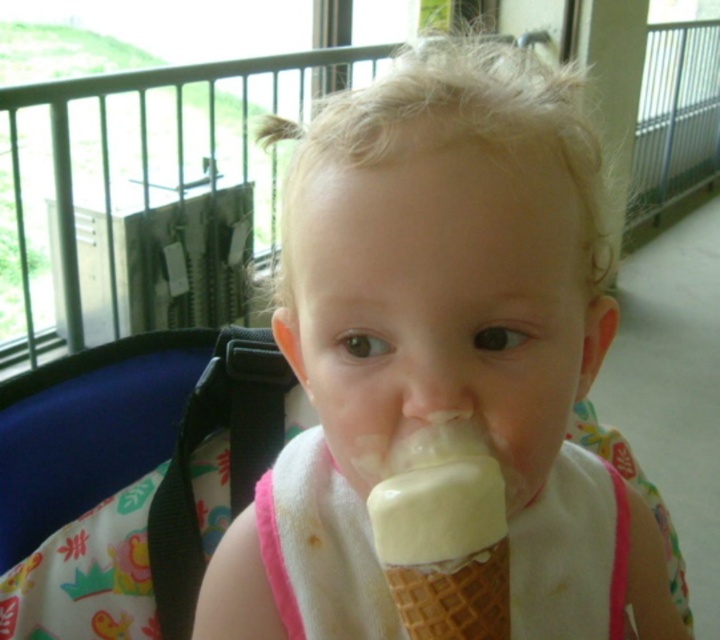
Is white matte ice cream cone at center to the left of vanilla ice cream at mouth from the viewer's perspective?

In fact, white matte ice cream cone at center is to the right of vanilla ice cream at mouth.

Does point (456, 193) come farther from viewer compared to point (392, 561)?

Yes, it is.

What are the coordinates of `white matte ice cream cone at center` in the screenshot? It's located at (441, 344).

The image size is (720, 640). Describe the element at coordinates (441, 344) in the screenshot. I see `white matte ice cream cone at center` at that location.

Which is more to the left, white matte ice cream cone at center or white fabric bib at mouth?

white fabric bib at mouth

Who is more forward, (324, 397) or (516, 634)?

Point (324, 397) is in front.

At what (x,y) coordinates should I click in order to perform the action: click on white matte ice cream cone at center. Please return your answer as a coordinate pair (x, y). Looking at the image, I should click on (441, 344).

Who is more distant from viewer, (608, 540) or (431, 570)?

The point (608, 540) is behind.

Measure the distance from white fabric bib at mouth to vanilla ice cream at mouth.

The distance of white fabric bib at mouth from vanilla ice cream at mouth is 5.98 inches.

Is point (626, 547) closer to camera compared to point (384, 500)?

No, (626, 547) is further to viewer.

Find the location of a particular element. white fabric bib at mouth is located at coordinates (320, 548).